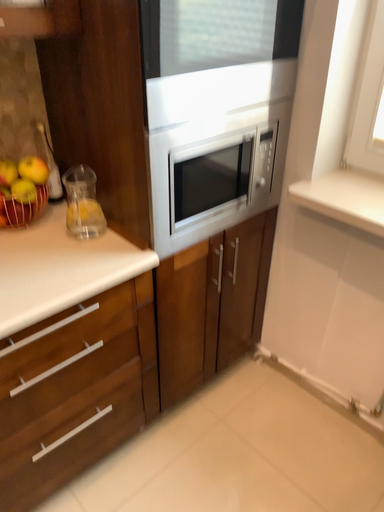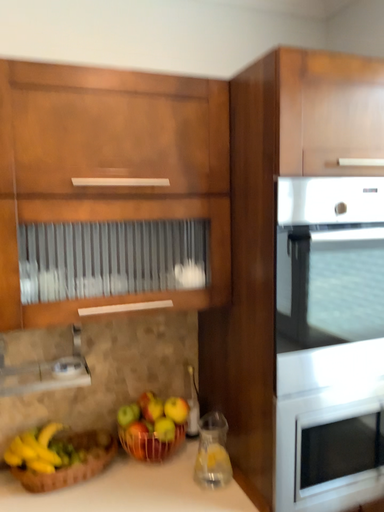
Question: How did the camera likely rotate when shooting the video?

Choices:
 (A) rotated downward
 (B) rotated upward

Answer: (B)